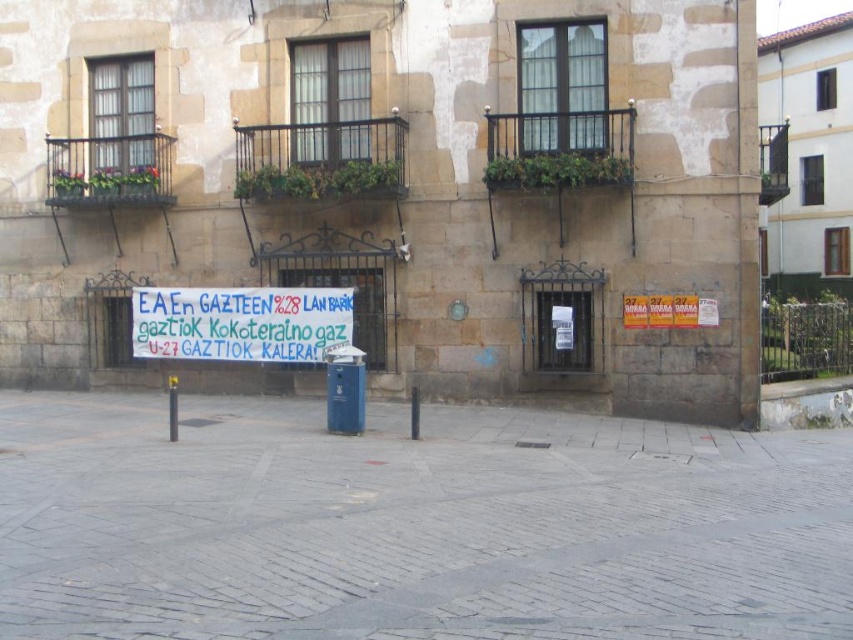
You are a delivery person trying to park your bike near the blue trash bin. The yellow plastic pole at center is blocking the path. Can you move the bike around the gray cobblestone pavement at center since it is shorter than the pole?

The gray cobblestone pavement at center is shorter than the yellow plastic pole at center, so yes, you can move the bike around the gray cobblestone pavement at center since it is lower and won

You are standing at the camera position and want to throw a frisbee to the white paper banner at center. Can you reach it with a throw of 20 meters?

The distance between you and the white paper banner at center is 18.24 meters, so yes, you can reach it with a 20 meters throw.